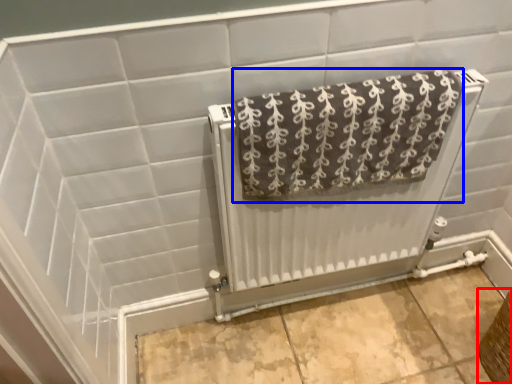
Question: Which object is closer to the camera taking this photo, basket (highlighted by a red box) or towel (highlighted by a blue box)?

Choices:
 (A) basket
 (B) towel

Answer: (B)